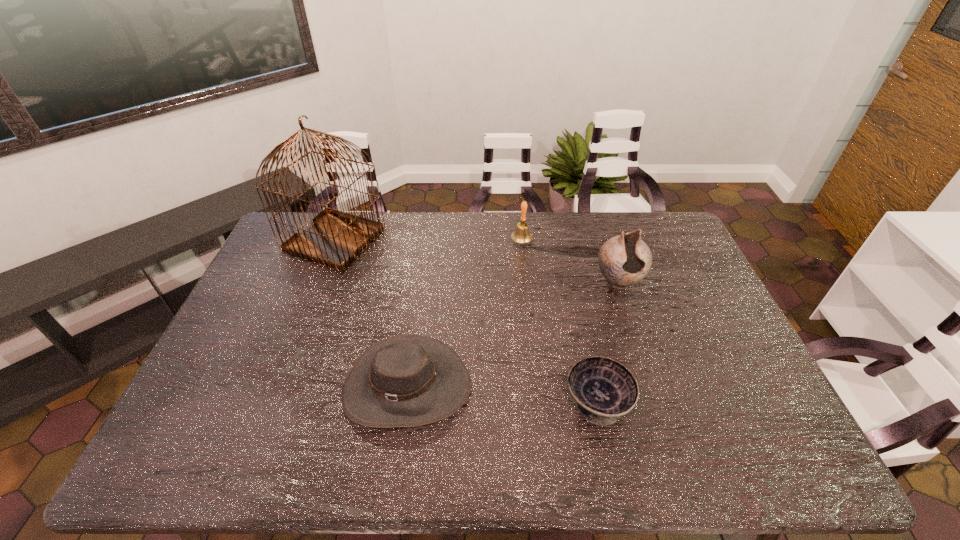
At what (x,y) coordinates should I click in order to perform the action: click on birdcage. Please return your answer as a coordinate pair (x, y). This screenshot has height=540, width=960. Looking at the image, I should click on (336, 239).

I want to click on pottery, so click(624, 260).

You are a GUI agent. You are given a task and a screenshot of the screen. Output one action in this format:
    pyautogui.click(x=<x>, y=<y>)
    Task: Click on the third tallest object
    This screenshot has height=540, width=960.
    Given the screenshot: What is the action you would take?
    pyautogui.click(x=521, y=235)

Locate an element on the screen. Image resolution: width=960 pixels, height=540 pixels. bell is located at coordinates (521, 235).

This screenshot has width=960, height=540. I want to click on the second shortest object, so click(410, 380).

I want to click on the shortest object, so click(604, 389).

This screenshot has width=960, height=540. I want to click on vacant space located on the front of the birdcage, so click(x=296, y=343).

Where is `free space located from the spout of the fourth shortest object`? This screenshot has height=540, width=960. free space located from the spout of the fourth shortest object is located at coordinates (653, 387).

Find the location of a particular element. The width and height of the screenshot is (960, 540). free space located 0.140m on the left of the bell is located at coordinates (472, 241).

This screenshot has height=540, width=960. Find the location of `vacant space located 0.070m on the front-facing side of the cowboy hat`. vacant space located 0.070m on the front-facing side of the cowboy hat is located at coordinates (396, 466).